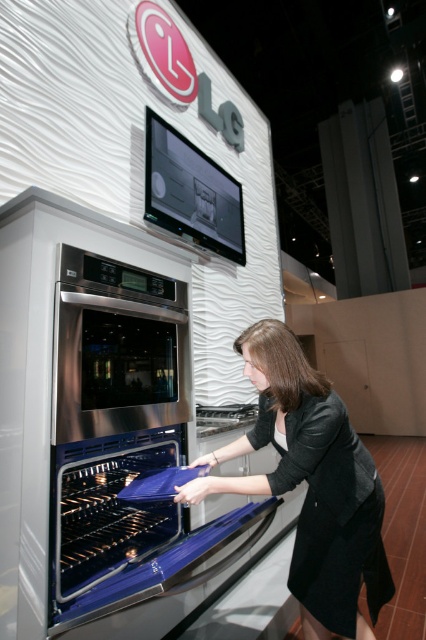
Is stainless steel oven at center to the left of black fabric dress at lower center from the viewer's perspective?

Yes, stainless steel oven at center is to the left of black fabric dress at lower center.

Does stainless steel oven at center appear on the right side of black fabric dress at lower center?

In fact, stainless steel oven at center is to the left of black fabric dress at lower center.

Does point (40, 401) lie behind point (356, 572)?

No, it is not.

Where is `stainless steel oven at center`? The image size is (426, 640). stainless steel oven at center is located at coordinates (98, 429).